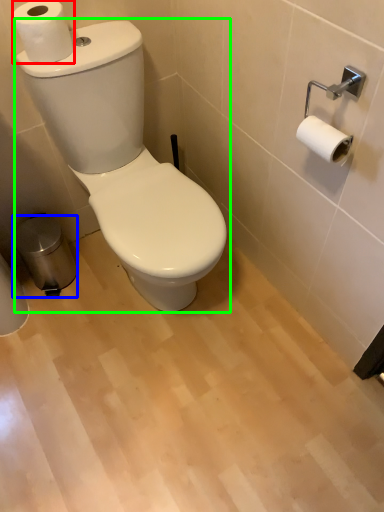
Question: Which object is the farthest from toilet paper (highlighted by a red box)? Choose among these: trash bin/can (highlighted by a blue box) or toilet (highlighted by a green box).

Choices:
 (A) trash bin/can
 (B) toilet

Answer: (A)